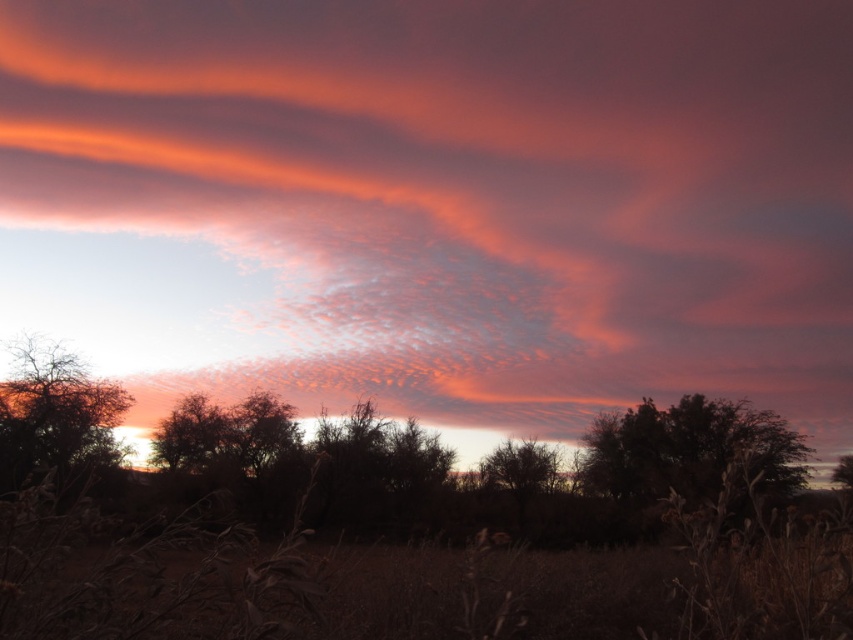
In the sunset scene, you see a silhouetted leafy tree at center and a silhouette tree at center. Which tree is positioned to the right?

The silhouetted leafy tree at center is positioned to the right of the silhouette tree at center.

You are standing in the field of dry grass and looking at the two trees in the distance. Which tree is closer to you, the silhouetted leafy tree at center or the silhouette tree at center?

The silhouetted leafy tree at center is closer to the viewer than the silhouette tree at center.

Based on the photo, you are a bird flying over the sunset scene. You want to land on the nearest tree to rest. Which tree should you choose between the silhouetted leafy tree at center and the silhouette leafy tree at left?

The silhouetted leafy tree at center and silhouette leafy tree at left are 101.91 feet apart from each other. Since you are flying over the scene, the distance between them is the same from your perspective. However, if you are closer to one tree, you should choose whichever is nearer to you. The given information does not specify your current position relative to the trees, so we cannot determine which is closer without additional details.